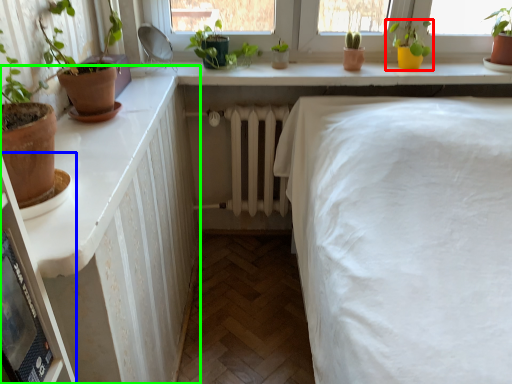
Question: Considering the real-world distances, which object is farthest from houseplant (highlighted by a red box)? shelf (highlighted by a blue box) or dresser (highlighted by a green box)?

Choices:
 (A) shelf
 (B) dresser

Answer: (A)